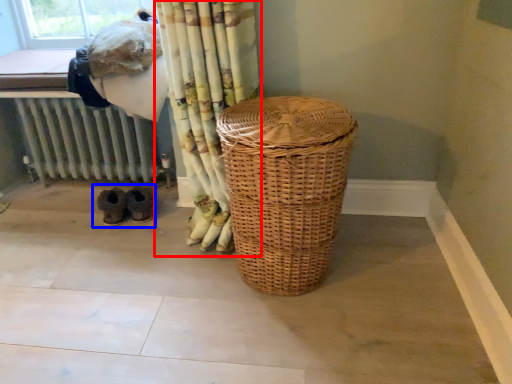
Question: Which object is closer to the camera taking this photo, curtain (highlighted by a red box) or footwear (highlighted by a blue box)?

Choices:
 (A) curtain
 (B) footwear

Answer: (A)